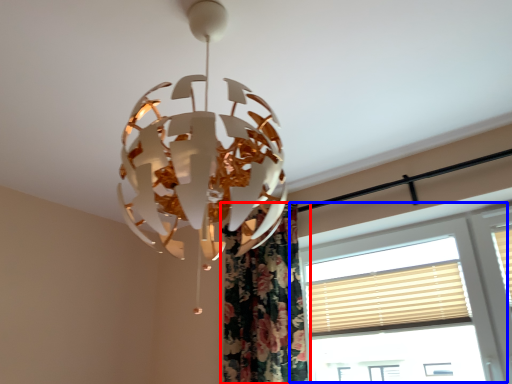
Question: Which object appears farthest to the camera in this image, curtain (highlighted by a red box) or window (highlighted by a blue box)?

Choices:
 (A) curtain
 (B) window

Answer: (A)